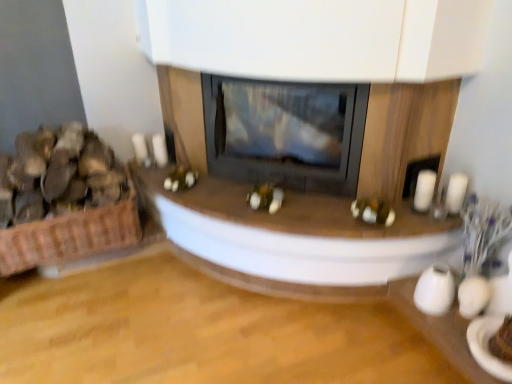
Where is `free point above wooden table at center (from a real-world perspective)`? free point above wooden table at center (from a real-world perspective) is located at coordinates (281, 201).